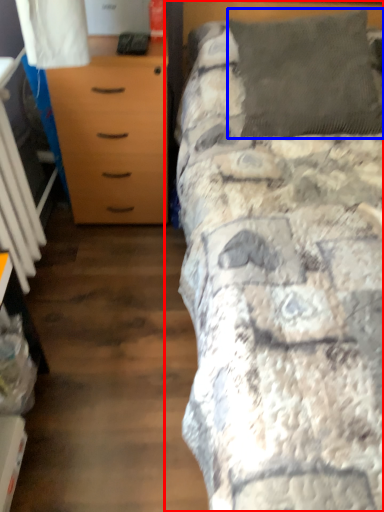
Question: Which point is further to the camera, bed (highlighted by a red box) or pillow (highlighted by a blue box)?

Choices:
 (A) bed
 (B) pillow

Answer: (B)